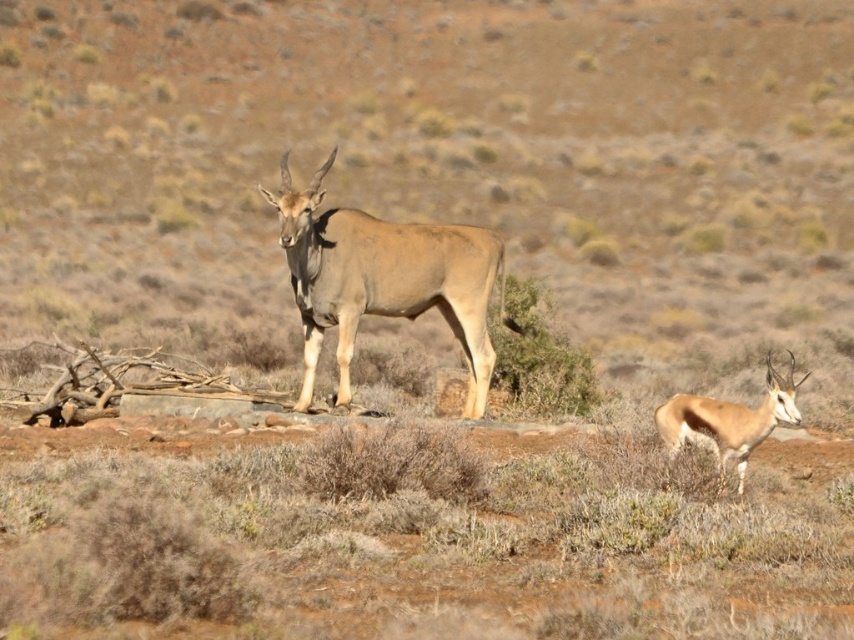
Is light brown fur antelope at center further to the viewer compared to smooth brown antelope at lower right?

That is True.

Between light brown fur antelope at center and smooth brown antelope at lower right, which one is positioned higher?

light brown fur antelope at center

Find the location of `light brown fur antelope at center`. light brown fur antelope at center is located at coordinates (384, 280).

Can you confirm if green leafy bush at center is smaller than smooth brown antelope at lower right?

Correct, green leafy bush at center occupies less space than smooth brown antelope at lower right.

Between point (519, 291) and point (700, 403), which one is positioned behind?

The point (519, 291) is more distant.

Between point (569, 388) and point (767, 400), which one is positioned in front?

Point (767, 400) is more forward.

Find the location of `green leafy bush at center`. green leafy bush at center is located at coordinates (537, 355).

Is light brown fur antelope at center bigger than green leafy bush at center?

Yes, light brown fur antelope at center is bigger than green leafy bush at center.

Is light brown fur antelope at center in front of green leafy bush at center?

Yes, it is in front of green leafy bush at center.

Where is `light brown fur antelope at center`? The image size is (854, 640). light brown fur antelope at center is located at coordinates (384, 280).